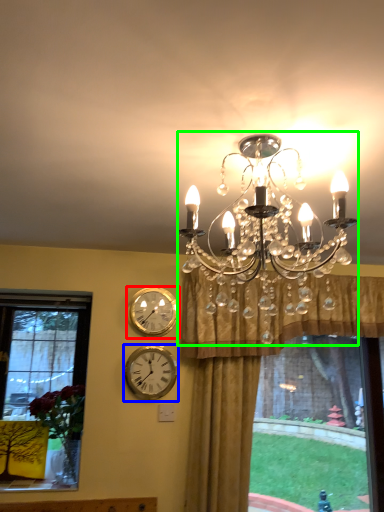
Question: Considering the real-world distances, which object is farthest from wall clock (highlighted by a red box)? wall clock (highlighted by a blue box) or lamp (highlighted by a green box)?

Choices:
 (A) wall clock
 (B) lamp

Answer: (B)